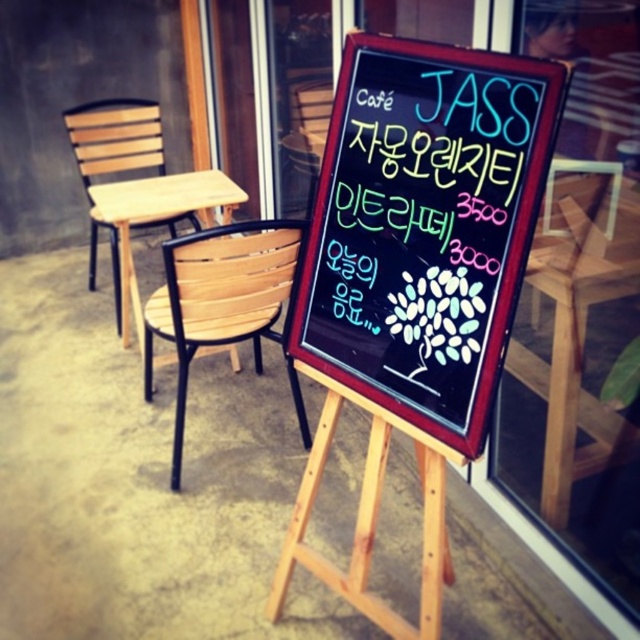
Question: Is wooden chair at center to the left of wooden slats at left from the viewer's perspective?

Choices:
 (A) yes
 (B) no

Answer: (B)

Question: Estimate the real-world distances between objects in this image. Which object is closer to the wooden slats at left?

Choices:
 (A) light wood table at center
 (B) black chalkboard at center
 (C) wooden chair at center

Answer: (A)

Question: Does black chalkboard at center appear under wooden at center?

Choices:
 (A) yes
 (B) no

Answer: (B)

Question: Can you confirm if wooden at center is wider than light wood table at center?

Choices:
 (A) yes
 (B) no

Answer: (B)

Question: Which object is farther from the camera taking this photo?

Choices:
 (A) wooden at center
 (B) wooden slats at left

Answer: (B)

Question: Which point is farther to the camera?

Choices:
 (A) light wood table at center
 (B) wooden at center

Answer: (A)